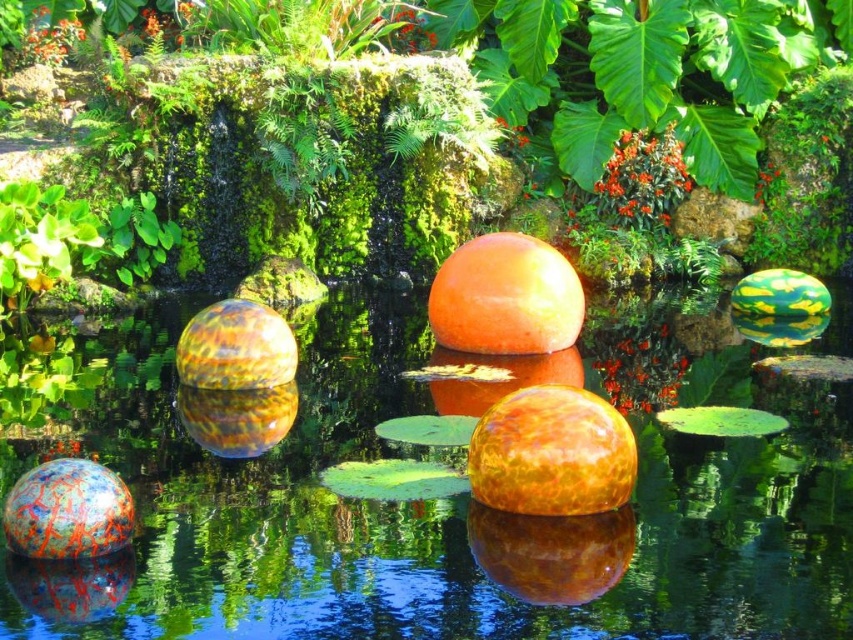
You are standing in the garden and see the point marked at coordinates (550,552). What object is located at that point?

The point at coordinates (550,552) corresponds to the glossy orange sphere at center.

You are a gardener planning to place a new decorative plant between the translucent orange sphere at center and the glossy orange sphere at center. Based on their positions, which sphere should the plant be closer to on its right side?

The plant should be placed closer to the glossy orange sphere at center because the translucent orange sphere at center is positioned on the left side of the glossy orange sphere at center.

You are a gardener standing in the garden and want to place a new plant between the glossy orange sphere at center and the green matte leaf at upper left. Which object should you place the plant closer to to ensure it is closer to the foreground?

The glossy orange sphere at center is in front of the green matte leaf at upper left, so placing the plant closer to the glossy orange sphere at center will keep it nearer to the foreground.